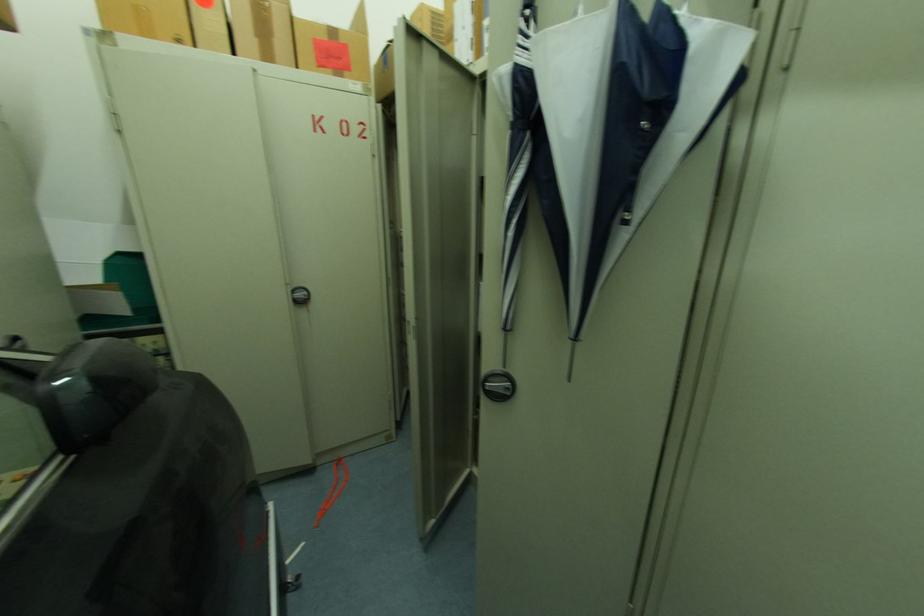
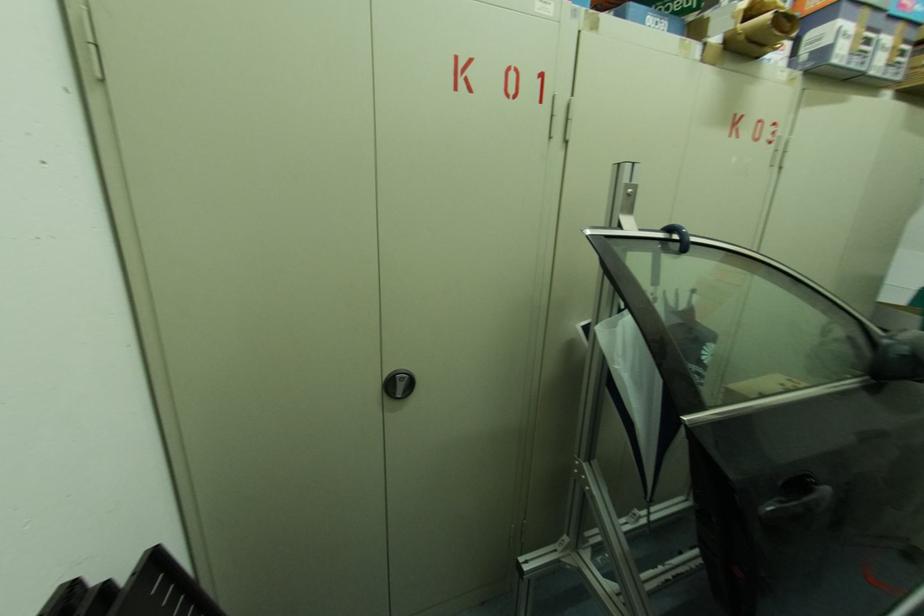
First-person continuous shooting, in which direction is the camera rotating?

Answer: The camera's rotation is toward left-down.